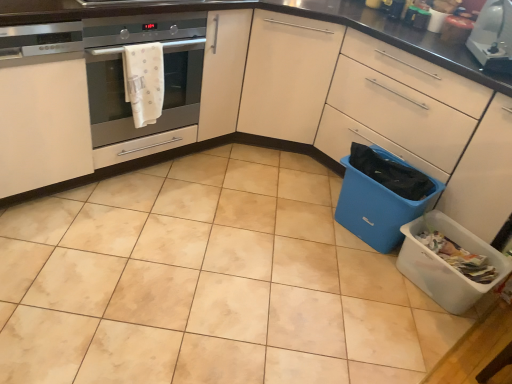
Identify the location of vacant area to the left of blue plastic recycling bin at lower right, the first recycling bin positioned from the top. (304, 218).